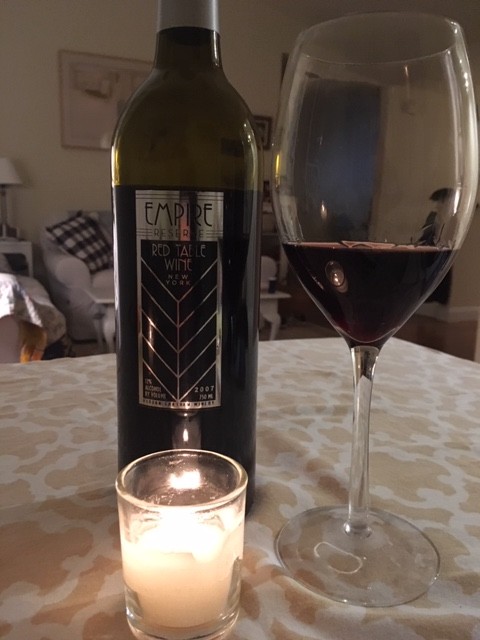
Find the location of a particular element. bottle of wine is located at coordinates (238, 228).